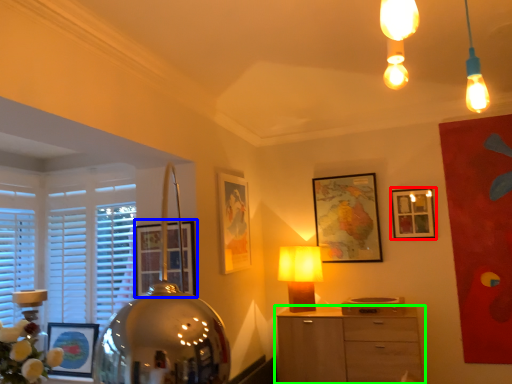
Question: Considering the real-world distances, which object is farthest from picture frame (highlighted by a red box)? picture frame (highlighted by a blue box) or chest of drawers (highlighted by a green box)?

Choices:
 (A) picture frame
 (B) chest of drawers

Answer: (A)